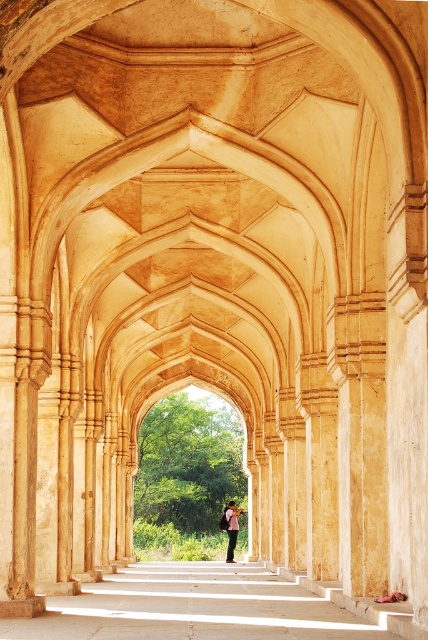
Between point (142, 636) and point (228, 516), which one is positioned behind?

Positioned behind is point (228, 516).

The image size is (428, 640). Describe the element at coordinates (193, 608) in the screenshot. I see `smooth stone path at center` at that location.

Between point (113, 632) and point (229, 513), which one is positioned in front?

Point (113, 632)

Locate an element on the screen. This screenshot has width=428, height=640. smooth stone path at center is located at coordinates (193, 608).